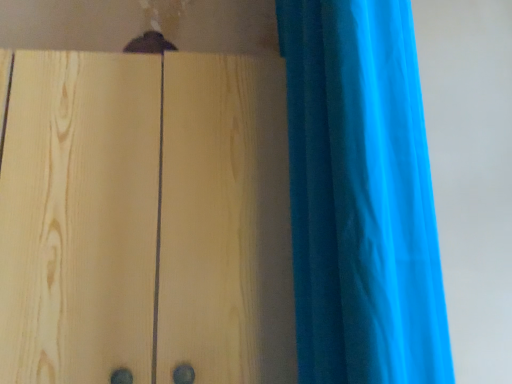
What do you see at coordinates (145, 219) in the screenshot? I see `natural wood cabinet at center` at bounding box center [145, 219].

This screenshot has height=384, width=512. Identify the location of natural wood cabinet at center. (145, 219).

Where is `natural wood cabinet at center`? The image size is (512, 384). natural wood cabinet at center is located at coordinates (145, 219).